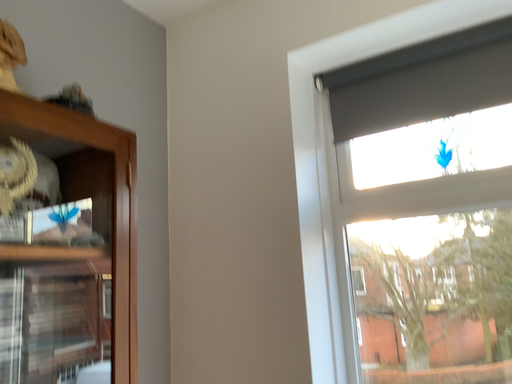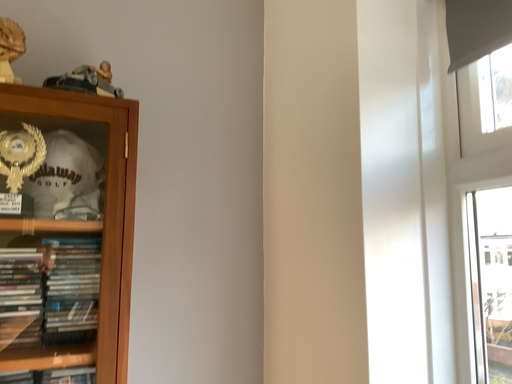
Question: How did the camera likely rotate when shooting the video?

Choices:
 (A) rotated right
 (B) rotated left

Answer: (B)